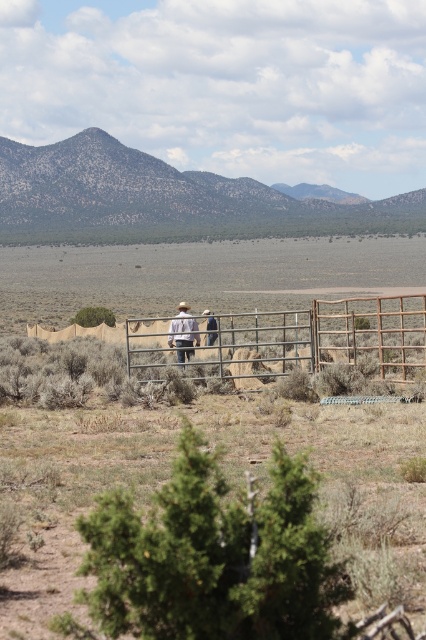
Between light brown leather cowboy hat at center and light brown leather jacket at center, which one appears on the right side from the viewer's perspective?

Positioned to the right is light brown leather jacket at center.

Does point (184, 304) come in front of point (213, 317)?

No.

Locate an element on the screen. This screenshot has width=426, height=640. light brown leather cowboy hat at center is located at coordinates (184, 328).

Can you confirm if metallic wire fence at center is bigger than light brown leather cowboy hat at center?

Indeed, metallic wire fence at center has a larger size compared to light brown leather cowboy hat at center.

Which is in front, point (28, 332) or point (175, 344)?

Positioned in front is point (175, 344).

This screenshot has width=426, height=640. In order to click on metallic wire fence at center in this screenshot , I will do click(x=322, y=337).

Who is more distant from viewer, [313,353] or [215,326]?

Positioned behind is point [215,326].

Can you confirm if metallic wire fence at center is positioned below light brown leather jacket at center?

Yes, metallic wire fence at center is below light brown leather jacket at center.

Measure the distance between metallic wire fence at center and camera.

They are 16.45 meters apart.

This screenshot has height=640, width=426. I want to click on metallic wire fence at center, so click(x=322, y=337).